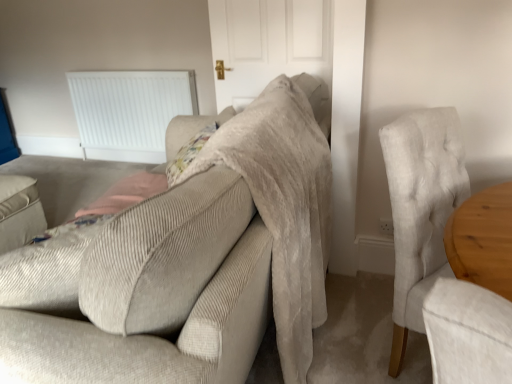
Question: Considering the relative positions of white matte door at center and light gray fabric chair at right in the image provided, is white matte door at center behind light gray fabric chair at right?

Choices:
 (A) yes
 (B) no

Answer: (A)

Question: Is white matte door at center bigger than light gray fabric chair at right?

Choices:
 (A) yes
 (B) no

Answer: (B)

Question: Does white matte door at center have a greater width compared to light gray fabric chair at right?

Choices:
 (A) no
 (B) yes

Answer: (A)

Question: Is white matte door at center not inside light gray fabric chair at right?

Choices:
 (A) no
 (B) yes

Answer: (B)

Question: From a real-world perspective, is white matte door at center physically below light gray fabric chair at right?

Choices:
 (A) no
 (B) yes

Answer: (A)

Question: Visually, is white matte door at center positioned to the left or to the right of beige corduroy couch at center?

Choices:
 (A) left
 (B) right

Answer: (B)

Question: From the image's perspective, is white matte door at center positioned above or below beige corduroy couch at center?

Choices:
 (A) below
 (B) above

Answer: (B)

Question: Relative to beige corduroy couch at center, is white matte door at center in front or behind?

Choices:
 (A) behind
 (B) front

Answer: (A)

Question: Looking at the image, does white matte door at center seem bigger or smaller compared to beige corduroy couch at center?

Choices:
 (A) small
 (B) big

Answer: (A)

Question: Is light gray fabric chair at right in front of or behind beige corduroy couch at center in the image?

Choices:
 (A) front
 (B) behind

Answer: (B)

Question: Considering the positions of point (442, 228) and point (3, 357), is point (442, 228) closer or farther from the camera than point (3, 357)?

Choices:
 (A) farther
 (B) closer

Answer: (A)

Question: Considering the positions of light gray fabric chair at right and beige corduroy couch at center in the image, is light gray fabric chair at right wider or thinner than beige corduroy couch at center?

Choices:
 (A) thin
 (B) wide

Answer: (A)

Question: Is light gray fabric chair at right to the left or to the right of beige corduroy couch at center in the image?

Choices:
 (A) right
 (B) left

Answer: (A)

Question: From a real-world perspective, is beige corduroy couch at center above or below light gray fabric chair at right?

Choices:
 (A) below
 (B) above

Answer: (B)

Question: In terms of size, does beige corduroy couch at center appear bigger or smaller than light gray fabric chair at right?

Choices:
 (A) small
 (B) big

Answer: (B)